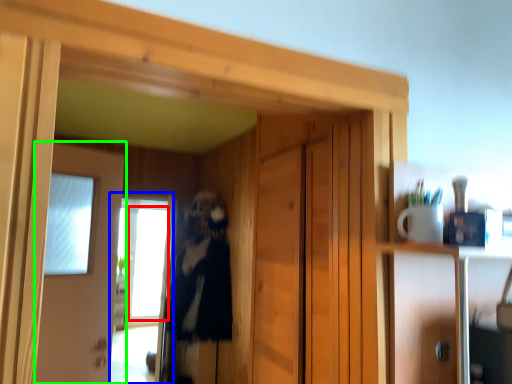
Question: Which object is positioned closest to window (highlighted by a red box)? Select from screen door (highlighted by a blue box) and door (highlighted by a green box).

Choices:
 (A) screen door
 (B) door

Answer: (A)